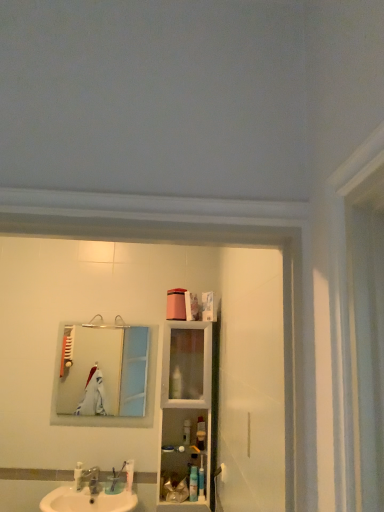
Locate an element on the screen. free space that is to the left of brushed metal faucet at sink front is located at coordinates (67, 496).